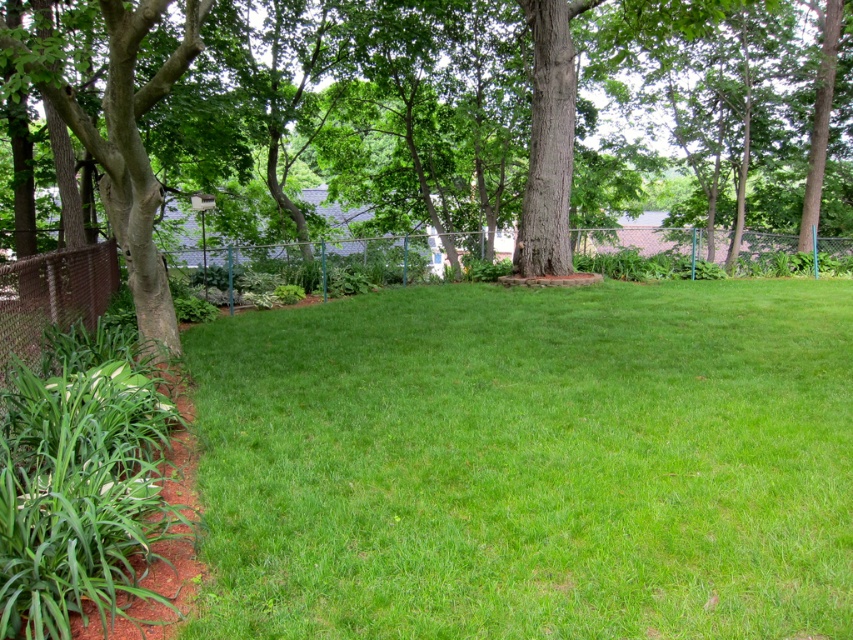
You are standing in the backyard and want to place a 2.5 meter long garden hose from your current position to the green grass at center. Is the distance sufficient to reach?

The green grass at center is 3.09 meters from camera. Since the garden hose is only 2.5 meters long, it is not long enough to reach the green grass at center from your current position.

Looking at this image, you are standing in the backyard and want to walk towards the green leafy tree at center. Which direction should you walk to avoid stepping on the green grass at center?

You should walk around the green grass at center since it is in front of the green leafy tree at center, so moving to the side would allow you to reach the tree without stepping on the grass.